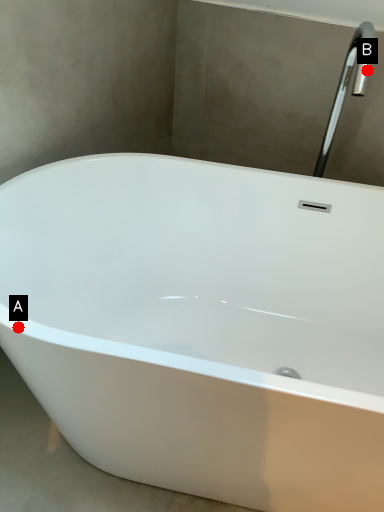
Question: Two points are circled on the image, labeled by A and B beside each circle. Among these points, which one is farthest from the camera?

Choices:
 (A) A is further
 (B) B is further

Answer: (B)